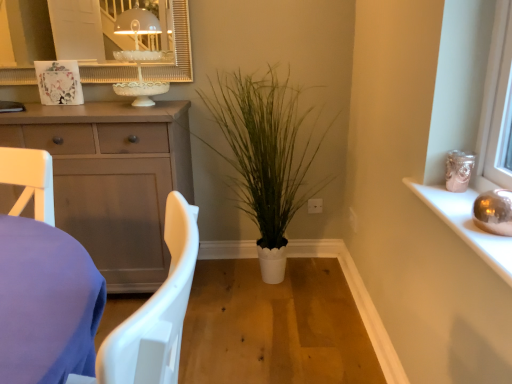
Identify the location of vacant space underneath white porcelain candle holder at upper center (from a real-world perspective). (138, 105).